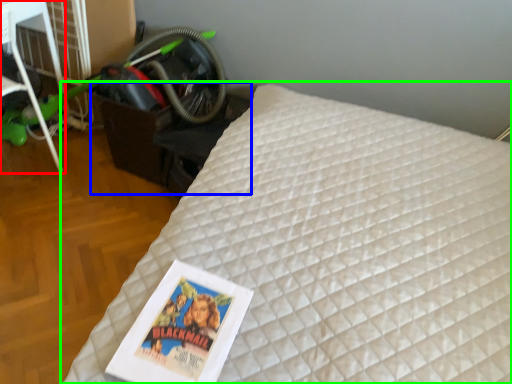
Question: Estimate the real-world distances between objects in this image. Which object is farther from furniture (highlighted by a red box), table (highlighted by a blue box) or bed (highlighted by a green box)?

Choices:
 (A) table
 (B) bed

Answer: (B)